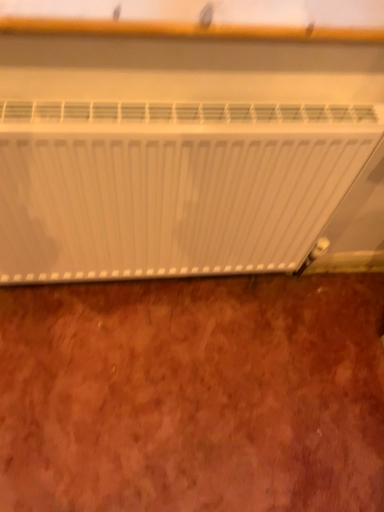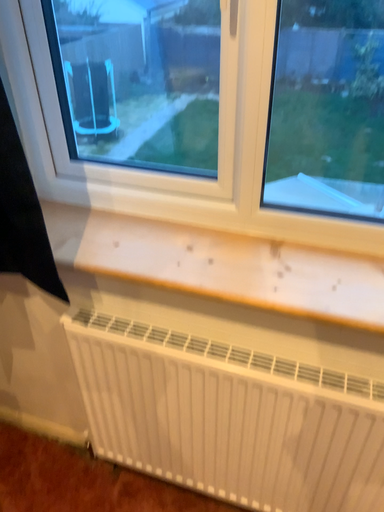
Question: How did the camera likely rotate when shooting the video?

Choices:
 (A) rotated upward
 (B) rotated downward

Answer: (A)